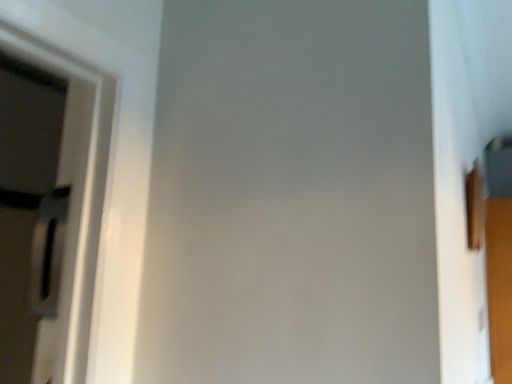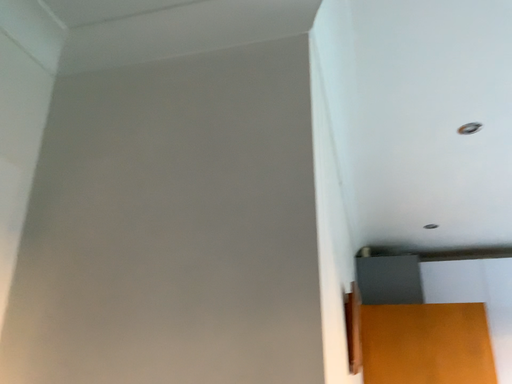
Question: How did the camera likely rotate when shooting the video?

Choices:
 (A) rotated left
 (B) rotated right

Answer: (B)